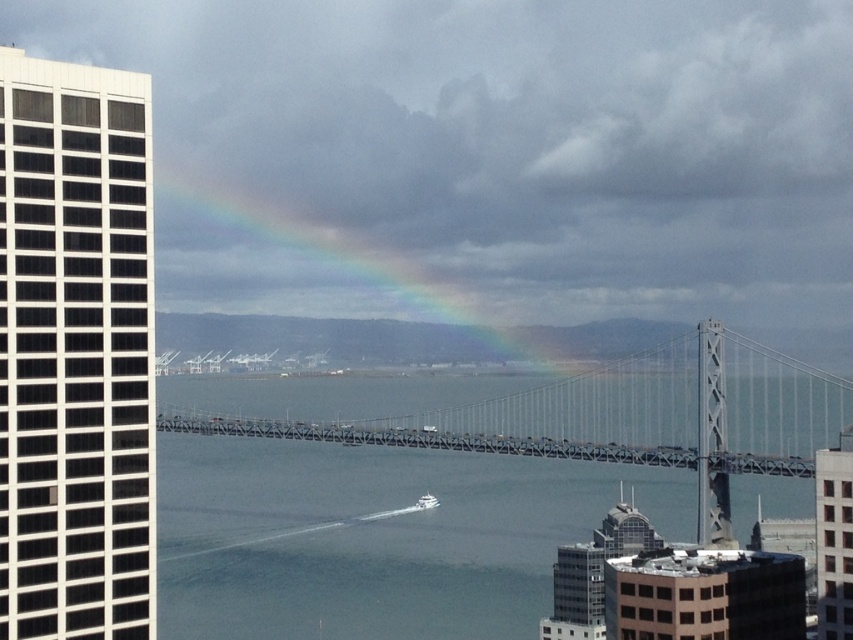
You are a photographer trying to capture a shot of the rainbow at upper center and the white glossy boat at center. Based on their sizes in the image, which one do you think occupies more horizontal space in the frame?

The rainbow at upper center might be wider than white glossy boat at center, so it likely occupies more horizontal space in the frame.

You are a photographer planning to capture the rainbow at upper center and the white glossy boat at center in the same frame. Based on their sizes in the image, which object would appear bigger in your photo?

The rainbow at upper center appears bigger in the photo because it has a larger size compared to the white glossy boat at center.